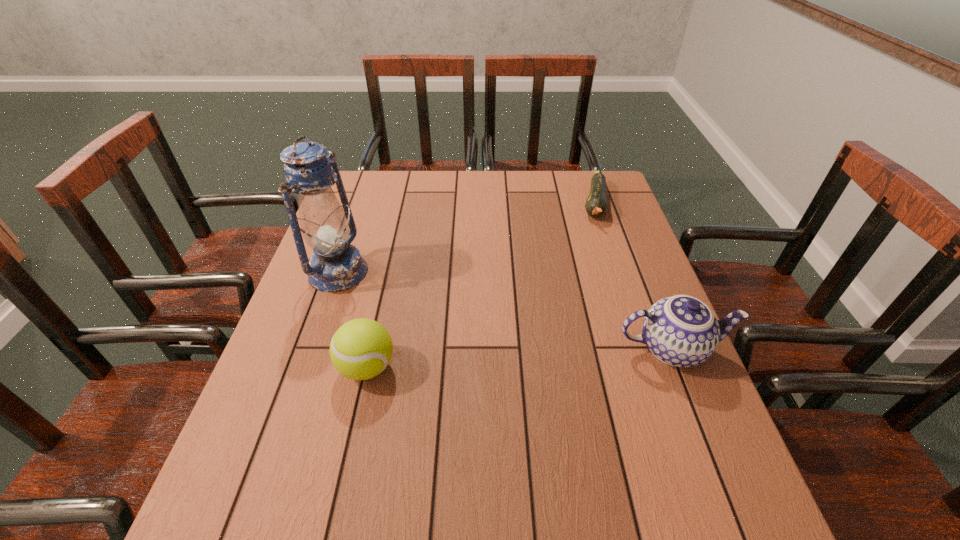
Identify the location of tennis ball. The height and width of the screenshot is (540, 960). (361, 349).

The width and height of the screenshot is (960, 540). I want to click on chinaware, so click(682, 331).

Where is `zucchini`? Image resolution: width=960 pixels, height=540 pixels. zucchini is located at coordinates (596, 205).

The image size is (960, 540). Find the location of `the farthest object`. the farthest object is located at coordinates (596, 205).

Locate an element on the screen. lantern is located at coordinates (335, 265).

Identify the location of the tallest object. This screenshot has width=960, height=540. (335, 265).

This screenshot has width=960, height=540. I want to click on free space located on the front of the tennis ball, so click(x=352, y=434).

Where is `vacant area located 0.050m at the blossom end of the zucchini`? The image size is (960, 540). vacant area located 0.050m at the blossom end of the zucchini is located at coordinates (596, 236).

This screenshot has height=540, width=960. Identify the location of vacant space located at the blossom end of the zucchini. (594, 246).

Identify the location of vacant region located 0.140m at the blossom end of the zucchini. (592, 255).